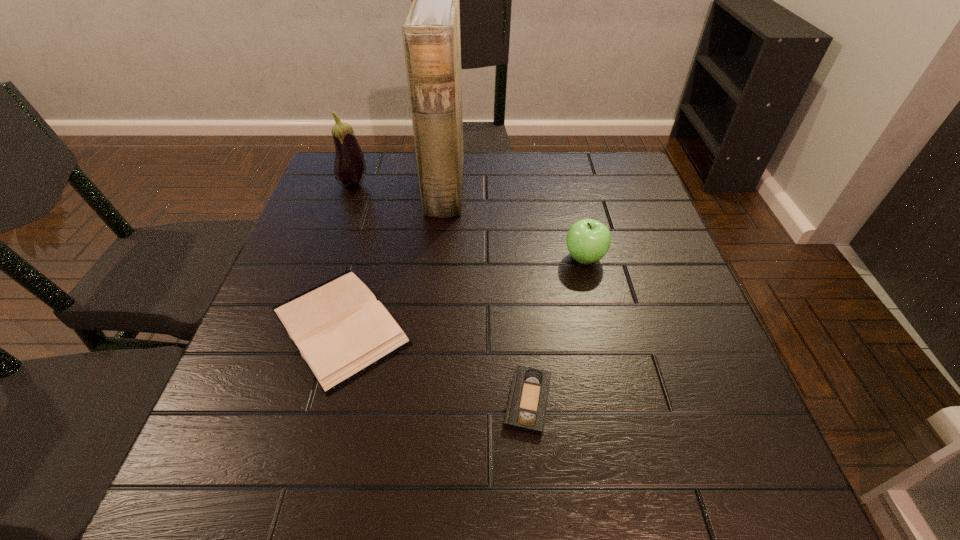
You are a GUI agent. You are given a task and a screenshot of the screen. Output one action in this format:
    pyautogui.click(x=<x>, y=<y>)
    Task: Click on the free space between the rightmost object and the hardback book
    This screenshot has width=960, height=540.
    Given the screenshot: What is the action you would take?
    pyautogui.click(x=462, y=292)

This screenshot has width=960, height=540. Identify the location of free area in between the videotape and the phonebook. (487, 293).

Image resolution: width=960 pixels, height=540 pixels. I want to click on free spot between the fourth shortest object and the shortest object, so click(441, 293).

Select which object appears as the fourth closest to the fourth object from left to right. Please provide its 2D coordinates. Your answer should be formatted as a tuple, i.e. [(x, y)], where the tuple contains the x and y coordinates of a point satisfying the conditions above.

[(349, 168)]

Locate an element on the screen. Image resolution: width=960 pixels, height=540 pixels. object that is the third nearest to the eggplant is located at coordinates [x=588, y=240].

The width and height of the screenshot is (960, 540). I want to click on vacant space that satisfies the following two spatial constraints: 1. on the cover of the tallest object; 2. on the back side of the shortest object, so click(x=424, y=401).

Identify the location of vacant space that satisfies the following two spatial constraints: 1. on the cover of the phonebook; 2. on the right side of the fourth object from left to right. (424, 401).

Find the location of `vacant area in the image that satisfies the following two spatial constraints: 1. on the cover of the second object from right to left; 2. on the left side of the tallest object`. vacant area in the image that satisfies the following two spatial constraints: 1. on the cover of the second object from right to left; 2. on the left side of the tallest object is located at coordinates (424, 401).

Where is `blank area in the image that satisfies the following two spatial constraints: 1. on the back side of the fourth tallest object; 2. on the right side of the apple`? blank area in the image that satisfies the following two spatial constraints: 1. on the back side of the fourth tallest object; 2. on the right side of the apple is located at coordinates (359, 258).

What are the coordinates of `free space that satisfies the following two spatial constraints: 1. on the cover of the phonebook; 2. on the back side of the apple` in the screenshot? It's located at 438,258.